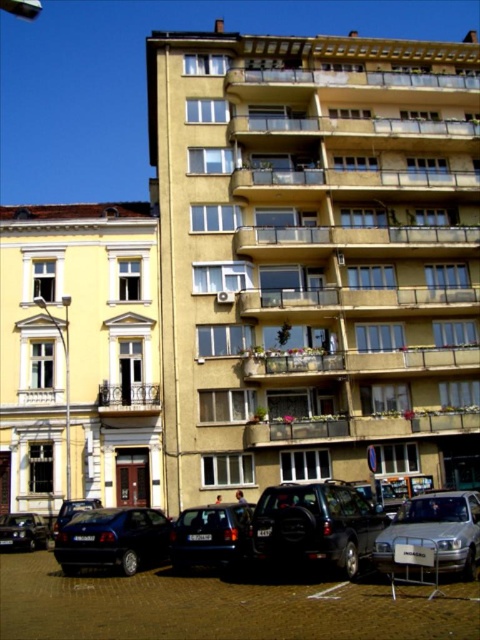
Does shiny black car at lower left have a larger size compared to metallic silver car at lower left?

Yes, shiny black car at lower left is bigger than metallic silver car at lower left.

This screenshot has width=480, height=640. What do you see at coordinates (23, 531) in the screenshot?
I see `shiny black car at lower left` at bounding box center [23, 531].

Locate an element on the screen. shiny black car at lower left is located at coordinates (23, 531).

Which is more to the left, shiny black car at lower center or metallic silver car at lower left?

Positioned to the left is metallic silver car at lower left.

Which is below, shiny black car at lower center or metallic silver car at lower left?

metallic silver car at lower left is below.

Which is in front, point (223, 536) or point (79, 508)?

Point (223, 536)

At what (x,y) coordinates should I click in order to perform the action: click on shiny black car at lower center. Please return your answer as a coordinate pair (x, y). Image resolution: width=480 pixels, height=640 pixels. Looking at the image, I should click on (211, 536).

Is shiny black suv at center bigger than metallic silver car at lower left?

Indeed, shiny black suv at center has a larger size compared to metallic silver car at lower left.

Is shiny black suv at center positioned before metallic silver car at lower left?

Yes, shiny black suv at center is in front of metallic silver car at lower left.

Does point (290, 504) come farther from viewer compared to point (75, 512)?

No.

This screenshot has width=480, height=640. Identify the location of shiny black suv at center. (314, 528).